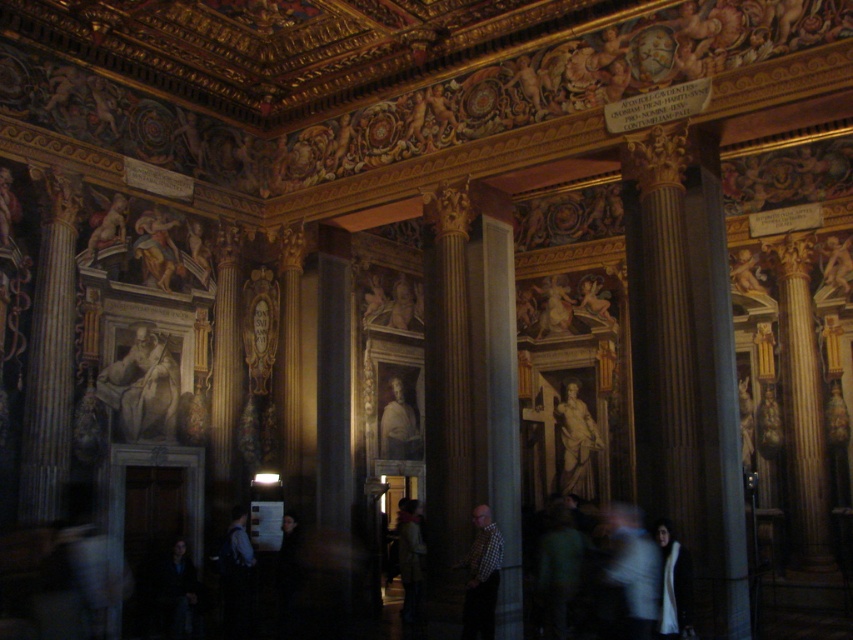
Question: Which of the following is the closest to the observer?

Choices:
 (A) dark brown leather coat at center
 (B) matte gray figure at center-left

Answer: (B)

Question: Estimate the real-world distances between objects in this image. Which object is closer to the white wool scarf at lower right?

Choices:
 (A) white cotton shirt at center
 (B) smooth gray statue at center

Answer: (A)

Question: Does checkered fabric shirt at center appear under dark brown leather coat at center?

Choices:
 (A) no
 (B) yes

Answer: (A)

Question: Is checkered fabric shirt at center to the right of dark brown leather coat at center from the viewer's perspective?

Choices:
 (A) no
 (B) yes

Answer: (B)

Question: Which object is closer to the camera taking this photo?

Choices:
 (A) dark brown leather coat at center
 (B) smooth gray statue at center
 (C) white wool scarf at lower right

Answer: (C)

Question: Does white wool scarf at lower right appear on the right side of dark brown leather coat at center?

Choices:
 (A) no
 (B) yes

Answer: (B)